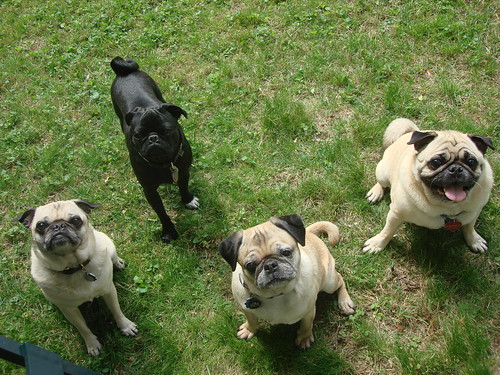
Where is `the chest`? Image resolution: width=500 pixels, height=375 pixels. the chest is located at coordinates (283, 314).